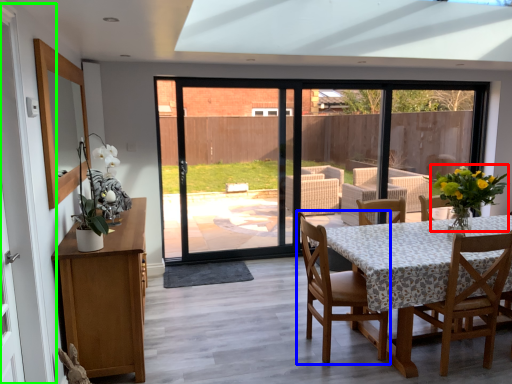
Question: Which is nearer to the floral arrangement (highlighted by a red box)? chair (highlighted by a blue box) or barn door (highlighted by a green box).

Choices:
 (A) chair
 (B) barn door

Answer: (A)